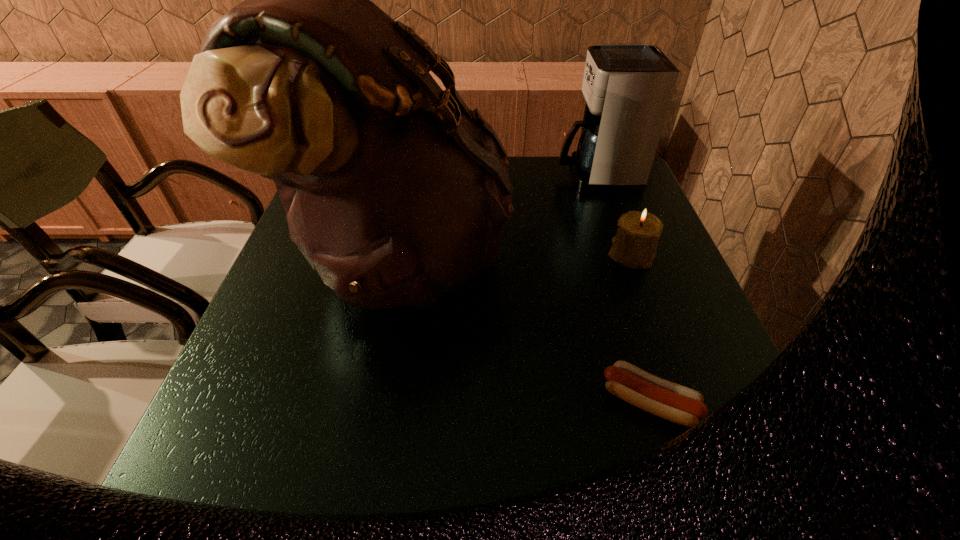
At what (x,y) coordinates should I click in order to perform the action: click on vacant space at the near edge of the desktop. Please return your answer as a coordinate pair (x, y). The height and width of the screenshot is (540, 960). Looking at the image, I should click on (413, 484).

Image resolution: width=960 pixels, height=540 pixels. In the image, there is a desktop. What are the coordinates of `vacant space at the left edge` in the screenshot? It's located at (252, 408).

Identify the location of vacant position at the right edge of the desktop. (598, 204).

I want to click on free space that is in between the candle_holder and the nearest object, so click(639, 328).

Locate an element on the screen. vacant point located between the candle_holder and the tallest object is located at coordinates (516, 256).

The height and width of the screenshot is (540, 960). What are the coordinates of `unoccupied position between the shortest object and the second tallest object` in the screenshot? It's located at (623, 289).

I want to click on vacant space that's between the third shortest object and the sausage, so click(623, 289).

I want to click on free spot between the satchel and the nearest object, so click(x=525, y=330).

Where is `vacant region between the second shortest object and the coffee maker`? This screenshot has height=540, width=960. vacant region between the second shortest object and the coffee maker is located at coordinates click(x=613, y=215).

What are the coordinates of `free space between the satchel and the third tallest object` in the screenshot? It's located at (516, 256).